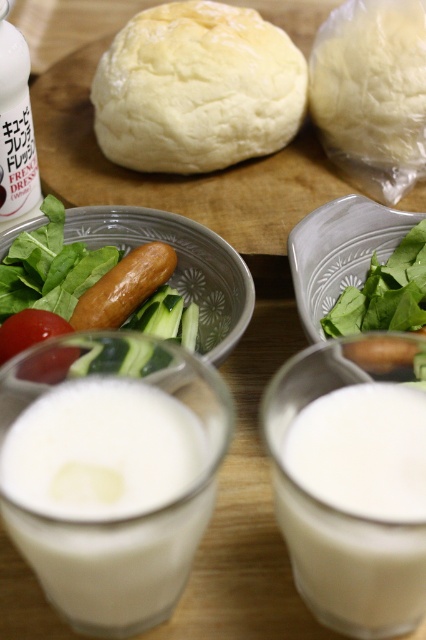
Question: Which point is closer to the camera?

Choices:
 (A) (11, 324)
 (B) (14, 99)
 (C) (399, 70)

Answer: (A)

Question: In this image, where is white matte dough at center located relative to white matte dough at upper right?

Choices:
 (A) left
 (B) right

Answer: (A)

Question: Does white opaque liquid at center appear under white frothy liquid at center?

Choices:
 (A) no
 (B) yes

Answer: (A)

Question: Considering the relative positions of white frothy liquid at center and green matte bowl at center in the image provided, where is white frothy liquid at center located with respect to green matte bowl at center?

Choices:
 (A) left
 (B) right

Answer: (A)

Question: Estimate the real-world distances between objects in this image. Which object is closer to the white matte dough at center?

Choices:
 (A) white opaque liquid at center
 (B) red matte tomato at lower left
 (C) brown glossy hot dog at center

Answer: (C)

Question: Estimate the real-world distances between objects in this image. Which object is farther from the white matte dough at center?

Choices:
 (A) brown glossy hot dog at center
 (B) white opaque liquid at center
 (C) white frothy liquid at center
 (D) white plastic bottle at upper left

Answer: (C)